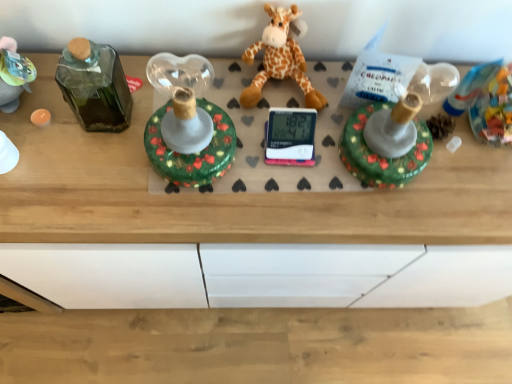
You are a GUI agent. You are given a task and a screenshot of the screen. Output one action in this format:
    pyautogui.click(x=<x>, y=<y>)
    Task: Click on the free point in front of shiny green glass candlestick at center
    
    Given the screenshot: What is the action you would take?
    pyautogui.click(x=170, y=213)